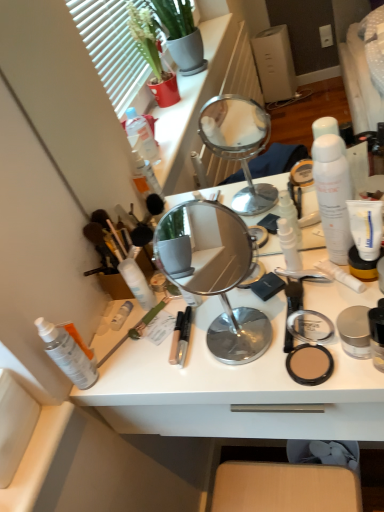
Image resolution: width=384 pixels, height=512 pixels. I want to click on vacant space in between green matte brush at center and white matte tube at right, the second toothpaste viewed from the top, so click(x=224, y=313).